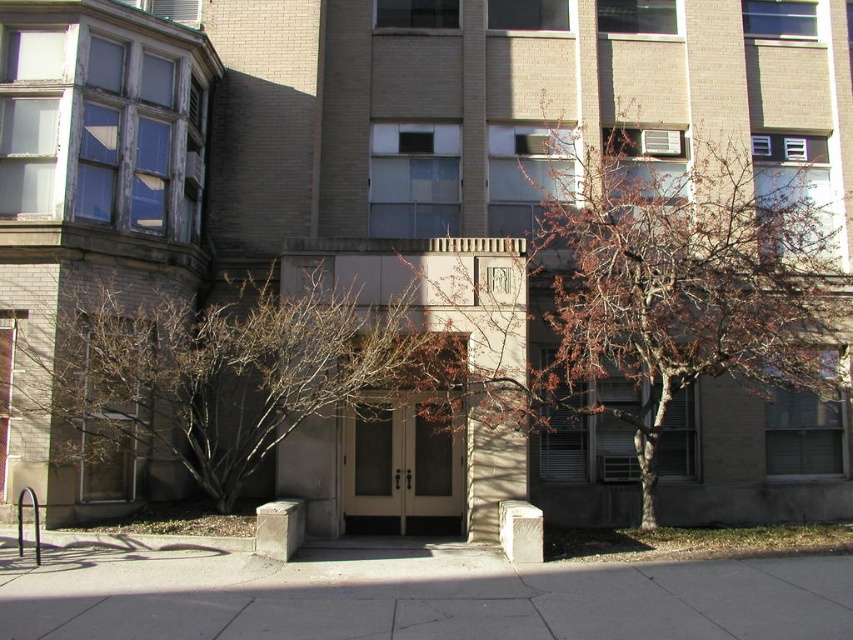
Looking at this image, you are a delivery person approaching the entrance of the building. You need to place a package on the gray concrete sidewalk at center. However, there is an obstacle made of bare branches at center. Can the package fit on the sidewalk without the branches blocking it?

The gray concrete sidewalk at center is shorter than the bare branches at center. Since the sidewalk is shorter, the branches may extend beyond the sidewalk, potentially blocking part of it. Therefore, the package might not fit entirely without obstruction.

You are a delivery person with a cart that is 2.5 meters wide. You need to move the cart from the parking lot to the entrance of the building. Is there enough space between the gray concrete sidewalk at center and the bare branches at center to maneuver your cart?

The distance between the gray concrete sidewalk at center and the bare branches at center is 3.07 meters. Since the cart is 2.5 meters wide, there is sufficient space to maneuver the cart through the area between them.

You are standing in front of the building and want to walk through the entrance. Which object, the brown textured tree at center or the bare branches at center, would you have to move past first?

The brown textured tree at center is closer to you than the bare branches at center, so you would have to move past the brown textured tree at center first.